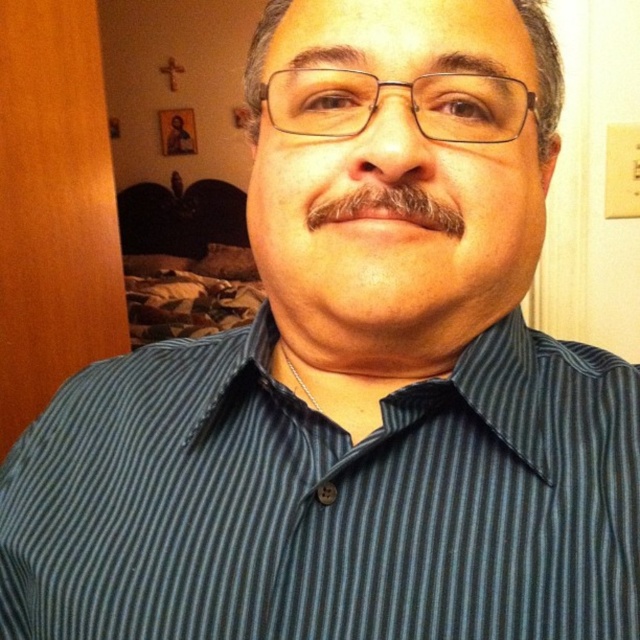
Question: Can you confirm if dark blue striped shirt at center is positioned below dark brown fuzzy mustache at center?

Choices:
 (A) yes
 (B) no

Answer: (A)

Question: Does dark blue striped shirt at center have a greater width compared to dark brown fuzzy mustache at center?

Choices:
 (A) no
 (B) yes

Answer: (B)

Question: Which point is closer to the camera?

Choices:
 (A) dark brown fuzzy mustache at center
 (B) dark blue striped shirt at center

Answer: (B)

Question: Can you confirm if dark blue striped shirt at center is smaller than dark brown fuzzy mustache at center?

Choices:
 (A) no
 (B) yes

Answer: (A)

Question: Which of the following is the closest to the observer?

Choices:
 (A) dark blue striped shirt at center
 (B) dark brown fuzzy mustache at center

Answer: (A)